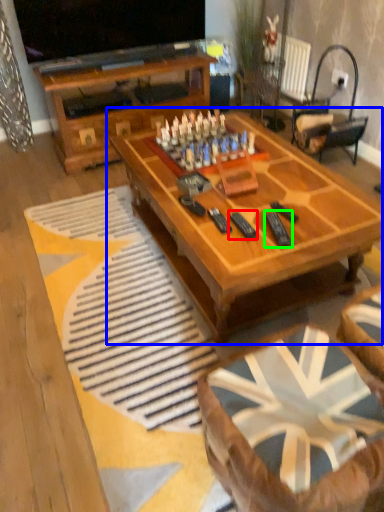
Question: Which is nearer to the remote (highlighted by a red box)? coffee table (highlighted by a blue box) or remote (highlighted by a green box).

Choices:
 (A) coffee table
 (B) remote

Answer: (B)